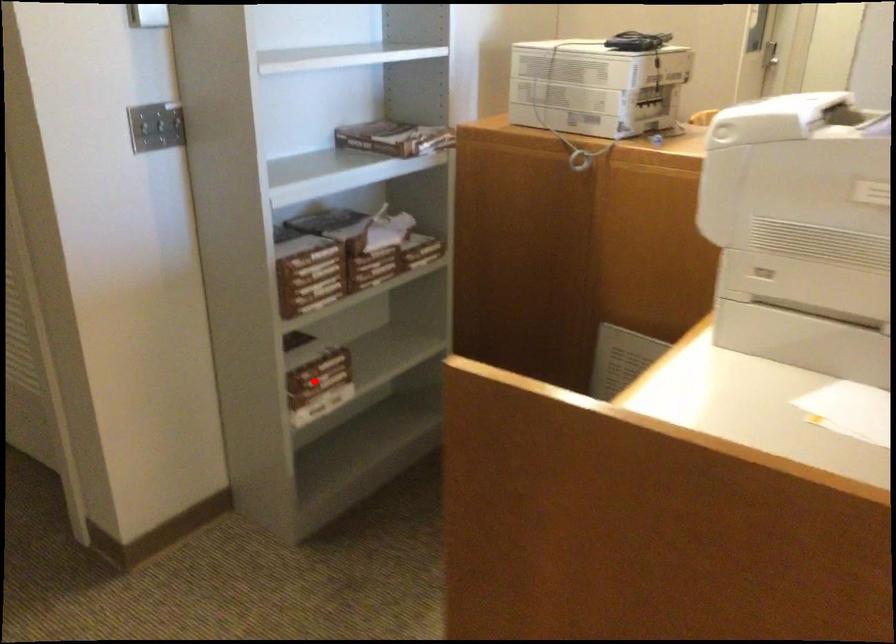
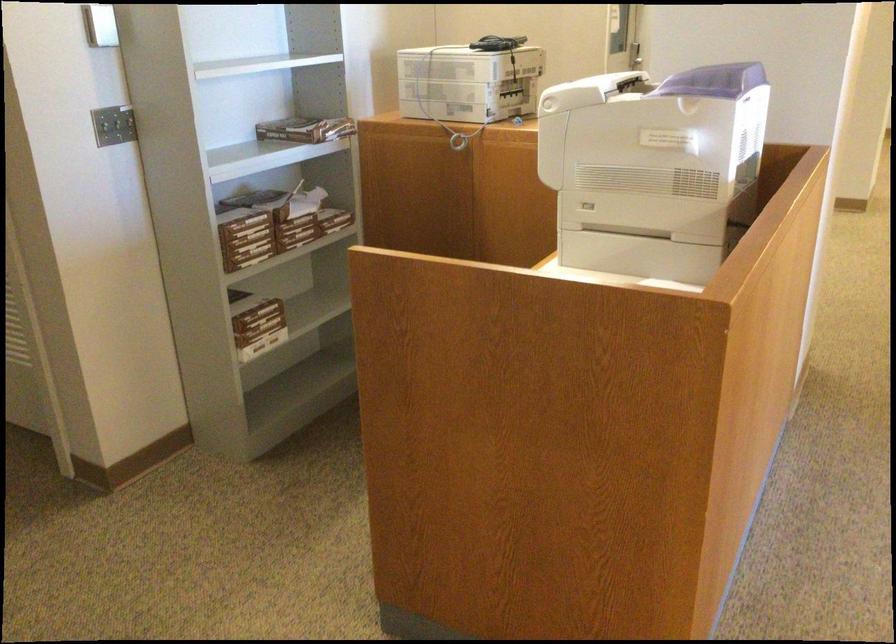
Question: I am providing you with two images of the same scene from different viewpoints. Image1 has a red point marked. In image2, the corresponding 3D location appears at what relative position? Reply with the corresponding letter.

Choices:
 (A) Closer
 (B) Farther

Answer: (B)